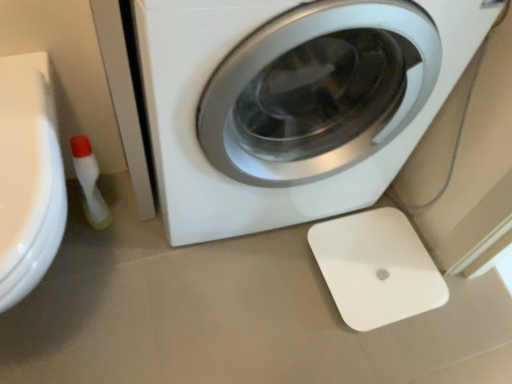
The image size is (512, 384). What do you see at coordinates (292, 102) in the screenshot?
I see `white glossy washing machine at center` at bounding box center [292, 102].

You are a GUI agent. You are given a task and a screenshot of the screen. Output one action in this format:
    pyautogui.click(x=<x>, y=<y>)
    Task: Click on the translucent plastic bottle at lower left
    The image size is (512, 384).
    Given the screenshot: What is the action you would take?
    pyautogui.click(x=89, y=183)

Is white plastic scale at lower right located outside white glossy washing machine at center?

Yes, white plastic scale at lower right is not within white glossy washing machine at center.

Does white plastic scale at lower right have a smaller size compared to white glossy washing machine at center?

Yes.

Could you tell me if white plastic scale at lower right is facing white glossy washing machine at center?

No, white plastic scale at lower right is not aimed at white glossy washing machine at center.

From the image's perspective, which is above, white plastic scale at lower right or white glossy washing machine at center?

white glossy washing machine at center is shown above in the image.

Image resolution: width=512 pixels, height=384 pixels. Find the location of `washing machine that appears above the translucent plastic bottle at lower left (from a real-world perspective)`. washing machine that appears above the translucent plastic bottle at lower left (from a real-world perspective) is located at coordinates (292, 102).

Between point (96, 171) and point (186, 45), which one is positioned in front?

The point (186, 45) is in front.

In the image, is translucent plastic bottle at lower left positioned in front of or behind white glossy washing machine at center?

translucent plastic bottle at lower left is positioned farther from the viewer than white glossy washing machine at center.

From the image's perspective, does translucent plastic bottle at lower left appear higher than white glossy washing machine at center?

No.

Between white glossy washing machine at center and white plastic scale at lower right, which one has less height?

white plastic scale at lower right is shorter.

Looking at this image, is white glossy washing machine at center aimed at white plastic scale at lower right?

Yes, white glossy washing machine at center is turned towards white plastic scale at lower right.

Who is more distant, white glossy washing machine at center or white plastic scale at lower right?

Positioned behind is white plastic scale at lower right.

From the image's perspective, which one is positioned lower, white glossy washing machine at center or translucent plastic bottle at lower left?

From the image's view, translucent plastic bottle at lower left is below.

From a real-world perspective, is white glossy washing machine at center over translucent plastic bottle at lower left?

Correct, in the physical world, white glossy washing machine at center is higher than translucent plastic bottle at lower left.

Which object is positioned more to the right, white glossy washing machine at center or translucent plastic bottle at lower left?

Positioned to the right is white glossy washing machine at center.

From the picture: Considering the sizes of white glossy washing machine at center and translucent plastic bottle at lower left in the image, is white glossy washing machine at center taller or shorter than translucent plastic bottle at lower left?

In the image, white glossy washing machine at center appears to be taller than translucent plastic bottle at lower left.

Considering the points (366, 254) and (88, 176), which point is behind, point (366, 254) or point (88, 176)?

Positioned behind is point (366, 254).

Can you confirm if white plastic scale at lower right is wider than translucent plastic bottle at lower left?

Correct, the width of white plastic scale at lower right exceeds that of translucent plastic bottle at lower left.

Based on the photo, could you tell me if white plastic scale at lower right is facing translucent plastic bottle at lower left?

No, white plastic scale at lower right is not facing towards translucent plastic bottle at lower left.

Who is bigger, white plastic scale at lower right or translucent plastic bottle at lower left?

translucent plastic bottle at lower left.

Is translucent plastic bottle at lower left not close to white plastic scale at lower right?

No.

Between translucent plastic bottle at lower left and white plastic scale at lower right, which one appears on the left side from the viewer's perspective?

translucent plastic bottle at lower left.

Is the position of translucent plastic bottle at lower left less distant than that of white plastic scale at lower right?

Yes, it is.

This screenshot has width=512, height=384. In the image, there is a translucent plastic bottle at lower left. Find the location of `appliance below it (from the image's perspective)`. appliance below it (from the image's perspective) is located at coordinates (376, 268).

Where is `appliance directly beneath the white glossy washing machine at center (from a real-world perspective)`? appliance directly beneath the white glossy washing machine at center (from a real-world perspective) is located at coordinates tap(376, 268).

At what (x,y) coordinates should I click in order to perform the action: click on cleaning product located below the white glossy washing machine at center (from the image's perspective). Please return your answer as a coordinate pair (x, y). This screenshot has height=384, width=512. Looking at the image, I should click on (89, 183).

Which object lies further to the anchor point translucent plastic bottle at lower left, white glossy washing machine at center or white plastic scale at lower right?

Based on the image, white plastic scale at lower right appears to be further to translucent plastic bottle at lower left.

Which object lies further to the anchor point translucent plastic bottle at lower left, white plastic scale at lower right or white glossy washing machine at center?

Based on the image, white plastic scale at lower right appears to be further to translucent plastic bottle at lower left.

Which object lies nearer to the anchor point white plastic scale at lower right, white glossy washing machine at center or translucent plastic bottle at lower left?

white glossy washing machine at center is positioned closer to the anchor white plastic scale at lower right.

From the image, which object appears to be farther from white glossy washing machine at center, translucent plastic bottle at lower left or white plastic scale at lower right?

The object further to white glossy washing machine at center is translucent plastic bottle at lower left.

Considering their positions, is white plastic scale at lower right positioned further to white glossy washing machine at center than translucent plastic bottle at lower left?

translucent plastic bottle at lower left is further to white glossy washing machine at center.

When comparing their distances from white plastic scale at lower right, does translucent plastic bottle at lower left or white glossy washing machine at center seem closer?

The object closer to white plastic scale at lower right is white glossy washing machine at center.

At what (x,y) coordinates should I click in order to perform the action: click on washing machine between translucent plastic bottle at lower left and white plastic scale at lower right. Please return your answer as a coordinate pair (x, y). Looking at the image, I should click on (292, 102).